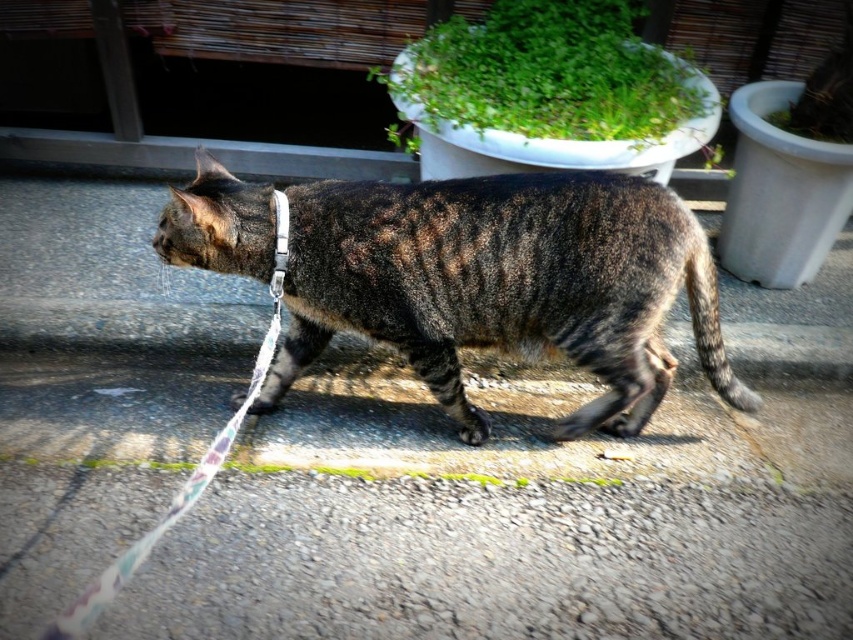
Is gray asphalt at center wider than green leafy plant at upper center?

Yes, gray asphalt at center is wider than green leafy plant at upper center.

Does gray asphalt at center appear on the right side of green leafy plant at upper center?

Incorrect, gray asphalt at center is not on the right side of green leafy plant at upper center.

Who is more distant from viewer, (790, 595) or (532, 108)?

The point (532, 108) is behind.

This screenshot has width=853, height=640. Identify the location of gray asphalt at center. (532, 500).

Is striped fur cat at center positioned behind green leafy plant at upper center?

No, it is in front of green leafy plant at upper center.

Does point (318, 216) come farther from viewer compared to point (527, 76)?

No, it is not.

Locate an element on the screen. The width and height of the screenshot is (853, 640). striped fur cat at center is located at coordinates (503, 284).

Is gray asphalt at center smaller than striped fur cat at center?

Actually, gray asphalt at center might be larger than striped fur cat at center.

How distant is gray asphalt at center from striped fur cat at center?

A distance of 24.80 inches exists between gray asphalt at center and striped fur cat at center.

Does point (312, 586) come in front of point (312, 356)?

Yes, it is in front of point (312, 356).

Find the location of a particular element. gray asphalt at center is located at coordinates (532, 500).